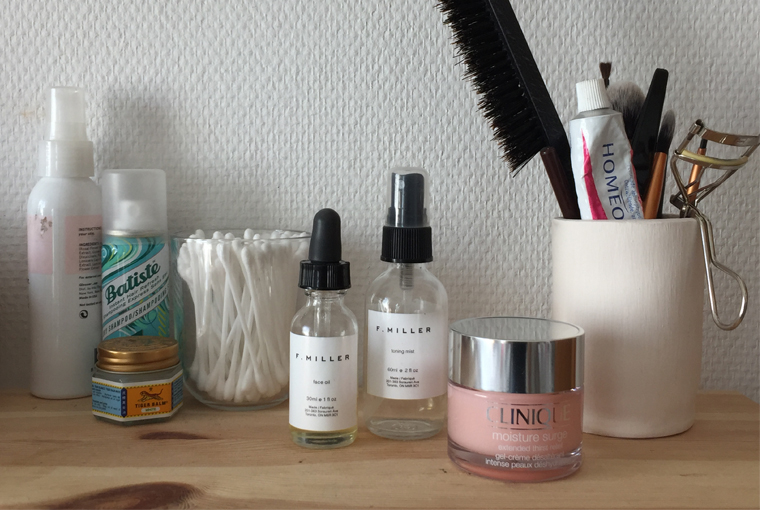
Find the location of a particular element. ceramic cup is located at coordinates (622, 293).